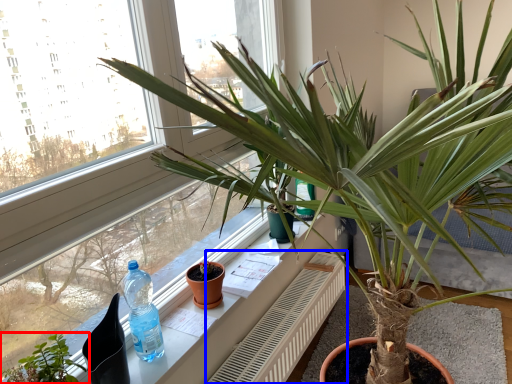
Question: Which of the following is the farthest to the observer, houseplant (highlighted by a red box) or radiator (highlighted by a blue box)?

Choices:
 (A) houseplant
 (B) radiator

Answer: (B)